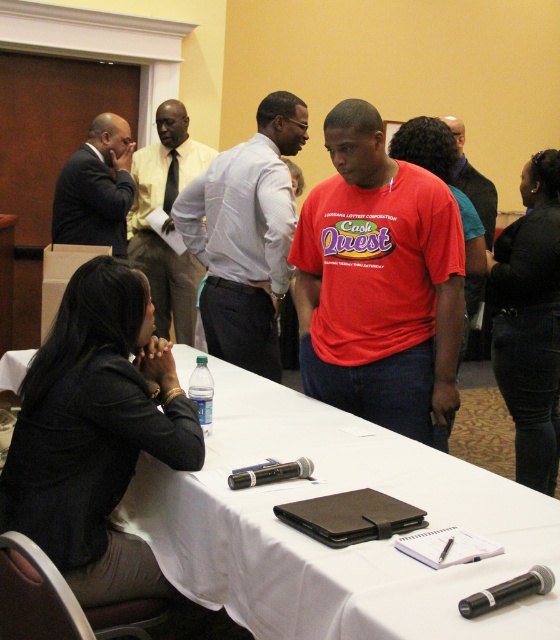
You are attending a meeting and need to locate the presenter who is wearing a dark suit at left. From your position at the entrance, which side of the white fabric table at center should you look towards to find them?

The dark suit at left is to the left of the white fabric table at center, so you should look towards the left side of the white fabric table at center to find the presenter.

Looking at this image, you are a person who is 1.80 meters tall and want to walk between the white fabric table at center and the dark suit at left. Is there enough space for you to walk through without bending down?

The distance between the white fabric table at center and the dark suit at left is 1.70 meters. Since you are 1.80 meters tall, the space is slightly narrower than your height, so you would need to bend down to pass through.